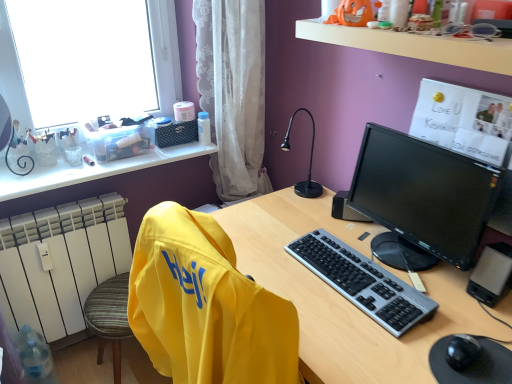
Locate an element on the screen. free space in front of black plastic keyboard at center is located at coordinates (380, 333).